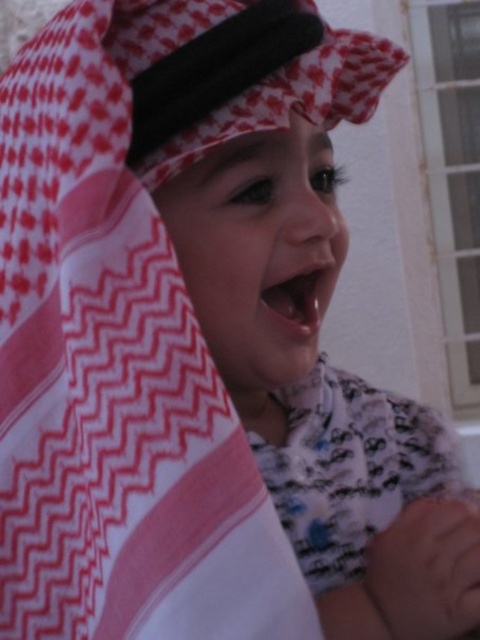
Consider the image. Who is more distant from viewer, (429,464) or (307,296)?

The point (429,464) is behind.

Can you confirm if white printed robe at center is taller than smooth pink lips at center?

Correct, white printed robe at center is much taller as smooth pink lips at center.

Which is in front, point (284, 461) or point (312, 282)?

Point (312, 282) is more forward.

Locate an element on the screen. white printed robe at center is located at coordinates (350, 468).

Is the position of white woven cloth at center more distant than that of white printed robe at center?

No, white woven cloth at center is closer to the viewer.

Does point (22, 560) come behind point (382, 500)?

No, (22, 560) is in front of (382, 500).

This screenshot has width=480, height=640. Describe the element at coordinates (113, 387) in the screenshot. I see `white woven cloth at center` at that location.

Where is `white woven cloth at center`? Image resolution: width=480 pixels, height=640 pixels. white woven cloth at center is located at coordinates pyautogui.click(x=113, y=387).

Which is more to the right, white woven cloth at center or smooth pink lips at center?

Positioned to the right is smooth pink lips at center.

Can you confirm if white woven cloth at center is positioned above smooth pink lips at center?

No.

In order to click on white woven cloth at center in this screenshot , I will do `click(113, 387)`.